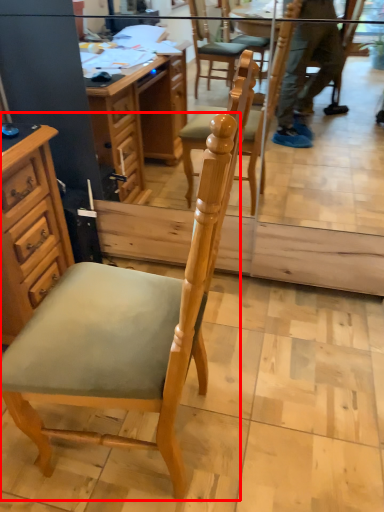
Question: In this image, where is chair (annotated by the red box) located relative to cabinetry?

Choices:
 (A) left
 (B) right

Answer: (B)